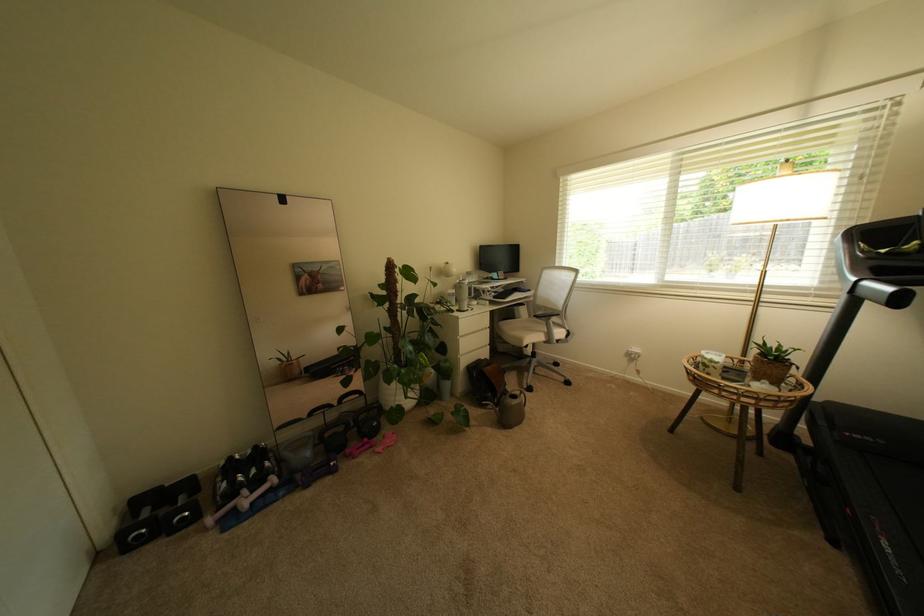
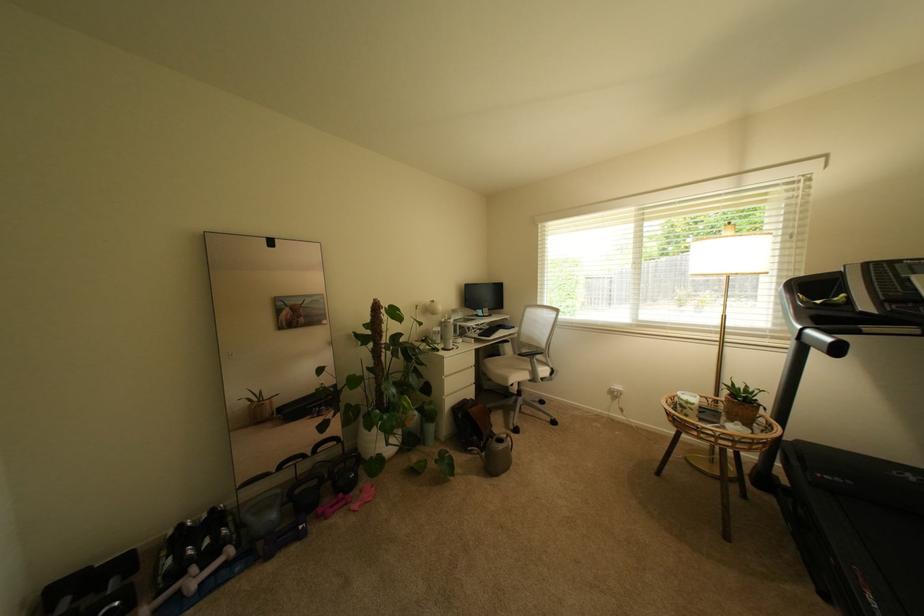
In the second image, find the point that corresponds to the point at 515,390 in the first image.

(500, 432)